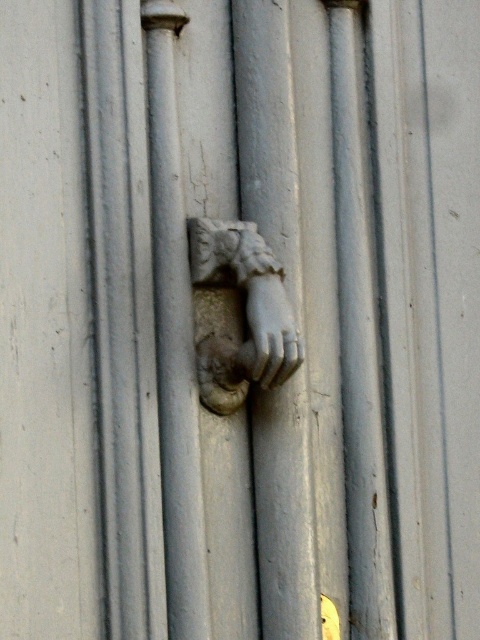
Question: Is stone textured hand at center below white marble hand at center?

Choices:
 (A) yes
 (B) no

Answer: (B)

Question: Does stone textured hand at center appear over white marble hand at center?

Choices:
 (A) yes
 (B) no

Answer: (A)

Question: Where is stone textured hand at center located in relation to white marble hand at center in the image?

Choices:
 (A) below
 (B) above

Answer: (B)

Question: Which object is closer to the camera taking this photo?

Choices:
 (A) white marble hand at center
 (B) stone textured hand at center

Answer: (A)